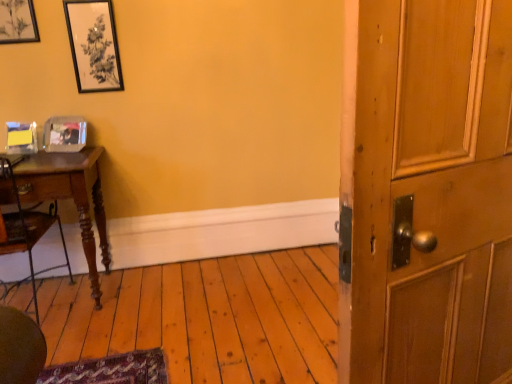
What do you see at coordinates (93, 45) in the screenshot?
I see `black matte picture frame at upper left, which ranks as the 2th picture frame in top-to-bottom order` at bounding box center [93, 45].

What do you see at coordinates (64, 134) in the screenshot?
I see `clear plastic picture frame at left, the 1th picture frame from the bottom` at bounding box center [64, 134].

What do you see at coordinates (70, 197) in the screenshot? I see `wooden desk at left` at bounding box center [70, 197].

Find the location of a particular element. Image resolution: width=512 pixels, height=384 pixels. matte black picture frame at upper left, the 3th picture frame ordered from the bottom is located at coordinates (18, 22).

How many degrees apart are the facing directions of matte black picture frame at upper left, the 3th picture frame ordered from the bottom, and wooden desk at left?

The angle between the facing direction of matte black picture frame at upper left, the 3th picture frame ordered from the bottom, and the facing direction of wooden desk at left is 0.0565 degrees.

Find the location of a particular element. This screenshot has width=512, height=384. desk below the matte black picture frame at upper left, the 3th picture frame ordered from the bottom (from a real-world perspective) is located at coordinates (70, 197).

Is matte black picture frame at upper left, the 1th picture frame from the top, to the left or to the right of wooden desk at left in the image?

From the image, it's evident that matte black picture frame at upper left, the 1th picture frame from the top, is to the left of wooden desk at left.

Is wooden desk at left inside matte black picture frame at upper left, the 3th picture frame ordered from the bottom?

No, wooden desk at left is not surrounded by matte black picture frame at upper left, the 3th picture frame ordered from the bottom.

Is clear plastic picture frame at left, which is the third picture frame in top-to-bottom order, positioned far away from wooden barn door at right?

Yes, clear plastic picture frame at left, which is the third picture frame in top-to-bottom order, and wooden barn door at right are quite far apart.

Considering the sizes of objects clear plastic picture frame at left, the 1th picture frame from the bottom, and wooden barn door at right in the image provided, who is smaller, clear plastic picture frame at left, the 1th picture frame from the bottom, or wooden barn door at right?

clear plastic picture frame at left, the 1th picture frame from the bottom, is smaller.

Is clear plastic picture frame at left, which is the third picture frame in top-to-bottom order, spatially inside wooden barn door at right, or outside of it?

The correct answer is: outside.

Where is `barn door that is in front of the clear plastic picture frame at left, which is the third picture frame in top-to-bottom order`? Image resolution: width=512 pixels, height=384 pixels. barn door that is in front of the clear plastic picture frame at left, which is the third picture frame in top-to-bottom order is located at coordinates (431, 194).

Is point (68, 121) behind point (11, 37)?

Yes, point (68, 121) is farther from viewer.

Locate an element on the screen. This screenshot has width=512, height=384. the 1st picture frame to the right of the matte black picture frame at upper left, the 3th picture frame ordered from the bottom, counting from the anchor's position is located at coordinates (64, 134).

Is the position of clear plastic picture frame at left, the 1th picture frame from the bottom, less distant than that of matte black picture frame at upper left, the 3th picture frame ordered from the bottom?

No, it is not.

Considering the relative sizes of clear plastic picture frame at left, the 1th picture frame from the bottom, and matte black picture frame at upper left, the 3th picture frame ordered from the bottom, in the image provided, is clear plastic picture frame at left, the 1th picture frame from the bottom, bigger than matte black picture frame at upper left, the 3th picture frame ordered from the bottom,?

Indeed, clear plastic picture frame at left, the 1th picture frame from the bottom, has a larger size compared to matte black picture frame at upper left, the 3th picture frame ordered from the bottom.

Is wooden barn door at right situated inside clear plastic picture frame at left, the 1th picture frame from the bottom, or outside?

wooden barn door at right lies outside clear plastic picture frame at left, the 1th picture frame from the bottom.

Measure the distance between wooden barn door at right and clear plastic picture frame at left, the 1th picture frame from the bottom.

1.95 meters.

Which is more to the right, wooden barn door at right or clear plastic picture frame at left, the 1th picture frame from the bottom?

Positioned to the right is wooden barn door at right.

From the image's perspective, count 1st picture frames upward from the wooden barn door at right and point to it. Please provide its 2D coordinates.

[(64, 134)]

From the image's perspective, between wooden barn door at right and matte black picture frame at upper left, the 1th picture frame from the top, which one is located above?

matte black picture frame at upper left, the 1th picture frame from the top, is shown above in the image.

Is wooden barn door at right facing away from matte black picture frame at upper left, the 1th picture frame from the top?

That's not correct — wooden barn door at right is not looking away from matte black picture frame at upper left, the 1th picture frame from the top.

Considering the sizes of objects wooden barn door at right and matte black picture frame at upper left, the 3th picture frame ordered from the bottom, in the image provided, who is thinner, wooden barn door at right or matte black picture frame at upper left, the 3th picture frame ordered from the bottom,?

matte black picture frame at upper left, the 3th picture frame ordered from the bottom.

Is black matte picture frame at upper left, arranged as the second picture frame when ordered from the bottom, further to the viewer compared to wooden desk at left?

Yes, black matte picture frame at upper left, arranged as the second picture frame when ordered from the bottom, is further from the viewer.

Is black matte picture frame at upper left, which ranks as the 2th picture frame in top-to-bottom order, to the left of wooden desk at left from the viewer's perspective?

No, black matte picture frame at upper left, which ranks as the 2th picture frame in top-to-bottom order, is not to the left of wooden desk at left.

Is black matte picture frame at upper left, which ranks as the 2th picture frame in top-to-bottom order, directly adjacent to wooden desk at left?

black matte picture frame at upper left, which ranks as the 2th picture frame in top-to-bottom order, and wooden desk at left are not in contact.

From a real-world perspective, is wooden barn door at right positioned over wooden desk at left based on gravity?

Correct, in the physical world, wooden barn door at right is higher than wooden desk at left.

Relative to wooden desk at left, is wooden barn door at right in front or behind?

In the image, wooden barn door at right appears in front of wooden desk at left.

Can you confirm if wooden barn door at right is smaller than wooden desk at left?

Indeed, wooden barn door at right has a smaller size compared to wooden desk at left.

Are wooden barn door at right and wooden desk at left far apart?

Yes, wooden barn door at right and wooden desk at left are located far from each other.

From the image's perspective, starting from the wooden desk at left, which picture frame is the 3rd one above? Please provide its 2D coordinates.

[(18, 22)]

Where is `barn door located below the clear plastic picture frame at left, the 1th picture frame from the bottom (from the image's perspective)`? barn door located below the clear plastic picture frame at left, the 1th picture frame from the bottom (from the image's perspective) is located at coordinates (431, 194).

Which object lies nearer to the anchor point matte black picture frame at upper left, the 3th picture frame ordered from the bottom, clear plastic picture frame at left, the 1th picture frame from the bottom, or wooden barn door at right?

Among the two, clear plastic picture frame at left, the 1th picture frame from the bottom, is located nearer to matte black picture frame at upper left, the 3th picture frame ordered from the bottom.

Estimate the real-world distances between objects in this image. Which object is closer to matte black picture frame at upper left, the 3th picture frame ordered from the bottom, wooden desk at left or wooden barn door at right?

wooden desk at left.

Which object lies nearer to the anchor point wooden desk at left, clear plastic picture frame at left, the 1th picture frame from the bottom, or wooden barn door at right?

clear plastic picture frame at left, the 1th picture frame from the bottom, is positioned closer to the anchor wooden desk at left.

Considering their positions, is wooden barn door at right positioned further to matte black picture frame at upper left, the 1th picture frame from the top, than wooden desk at left?

The object further to matte black picture frame at upper left, the 1th picture frame from the top, is wooden barn door at right.

Estimate the real-world distances between objects in this image. Which object is further from wooden barn door at right, matte black picture frame at upper left, the 3th picture frame ordered from the bottom, or black matte picture frame at upper left, which ranks as the 2th picture frame in top-to-bottom order?

Based on the image, matte black picture frame at upper left, the 3th picture frame ordered from the bottom, appears to be further to wooden barn door at right.

Estimate the real-world distances between objects in this image. Which object is closer to matte black picture frame at upper left, the 1th picture frame from the top, black matte picture frame at upper left, arranged as the second picture frame when ordered from the bottom, or clear plastic picture frame at left, which is the third picture frame in top-to-bottom order?

black matte picture frame at upper left, arranged as the second picture frame when ordered from the bottom, is positioned closer to the anchor matte black picture frame at upper left, the 1th picture frame from the top.

Estimate the real-world distances between objects in this image. Which object is further from wooden desk at left, matte black picture frame at upper left, the 1th picture frame from the top, or wooden barn door at right?

wooden barn door at right is positioned further to the anchor wooden desk at left.

Estimate the real-world distances between objects in this image. Which object is further from wooden desk at left, wooden barn door at right or clear plastic picture frame at left, the 1th picture frame from the bottom?

wooden barn door at right is further to wooden desk at left.

Image resolution: width=512 pixels, height=384 pixels. In order to click on desk situated between matte black picture frame at upper left, the 3th picture frame ordered from the bottom, and wooden barn door at right from left to right in this screenshot , I will do `click(70, 197)`.

This screenshot has height=384, width=512. Find the location of `picture frame between matte black picture frame at upper left, the 1th picture frame from the top, and clear plastic picture frame at left, which is the third picture frame in top-to-bottom order, in the vertical direction`. picture frame between matte black picture frame at upper left, the 1th picture frame from the top, and clear plastic picture frame at left, which is the third picture frame in top-to-bottom order, in the vertical direction is located at coordinates (93, 45).

Image resolution: width=512 pixels, height=384 pixels. In order to click on picture frame between black matte picture frame at upper left, arranged as the second picture frame when ordered from the bottom, and wooden desk at left vertically in this screenshot , I will do `click(64, 134)`.